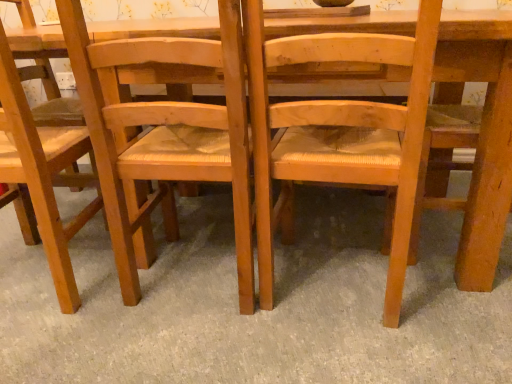
Image resolution: width=512 pixels, height=384 pixels. I want to click on vacant space underneath wooden woven seat at center, the second chair in the left-to-right sequence (from a real-world perspective), so pos(194,272).